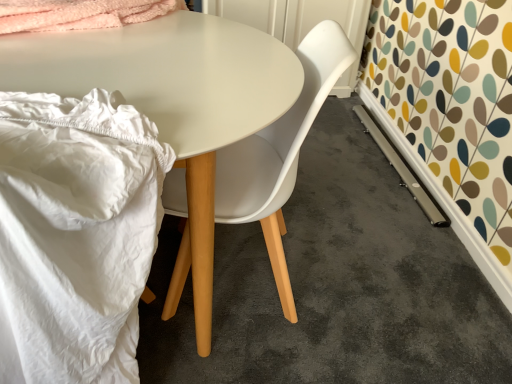
Question: Is white fabric at left positioned far away from white plastic chair at center?

Choices:
 (A) no
 (B) yes

Answer: (A)

Question: Is white fabric at left smaller than white plastic chair at center?

Choices:
 (A) no
 (B) yes

Answer: (B)

Question: Is white fabric at left bigger than white plastic chair at center?

Choices:
 (A) yes
 (B) no

Answer: (B)

Question: Can you confirm if white fabric at left is taller than white plastic chair at center?

Choices:
 (A) yes
 (B) no

Answer: (B)

Question: Is white fabric at left oriented towards white plastic chair at center?

Choices:
 (A) no
 (B) yes

Answer: (A)

Question: Considering the relative sizes of white fabric at left and white plastic chair at center in the image provided, is white fabric at left wider than white plastic chair at center?

Choices:
 (A) yes
 (B) no

Answer: (A)

Question: Is white plastic chair at center in front of white glossy table at center?

Choices:
 (A) no
 (B) yes

Answer: (A)

Question: Does white plastic chair at center have a greater width compared to white glossy table at center?

Choices:
 (A) yes
 (B) no

Answer: (B)

Question: From the image's perspective, does white plastic chair at center appear higher than white glossy table at center?

Choices:
 (A) yes
 (B) no

Answer: (A)

Question: Considering the relative positions of white plastic chair at center and white glossy table at center in the image provided, is white plastic chair at center to the left of white glossy table at center from the viewer's perspective?

Choices:
 (A) yes
 (B) no

Answer: (B)

Question: Is white plastic chair at center thinner than white glossy table at center?

Choices:
 (A) yes
 (B) no

Answer: (A)

Question: Does white plastic chair at center have a lesser height compared to white glossy table at center?

Choices:
 (A) no
 (B) yes

Answer: (A)

Question: Can you confirm if white glossy table at center is shorter than white fabric at left?

Choices:
 (A) no
 (B) yes

Answer: (B)